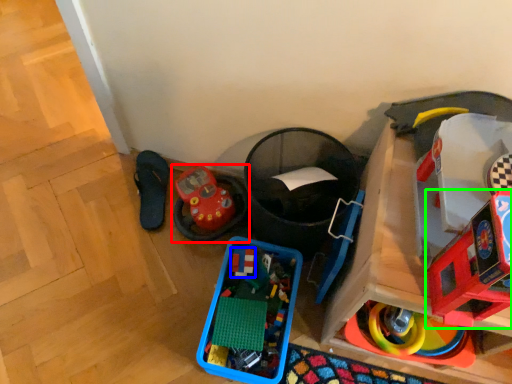
Question: Estimate the real-world distances between objects in this image. Which object is farther from toy (highlighted by a red box), toy (highlighted by a blue box) or toy (highlighted by a green box)?

Choices:
 (A) toy
 (B) toy

Answer: (B)